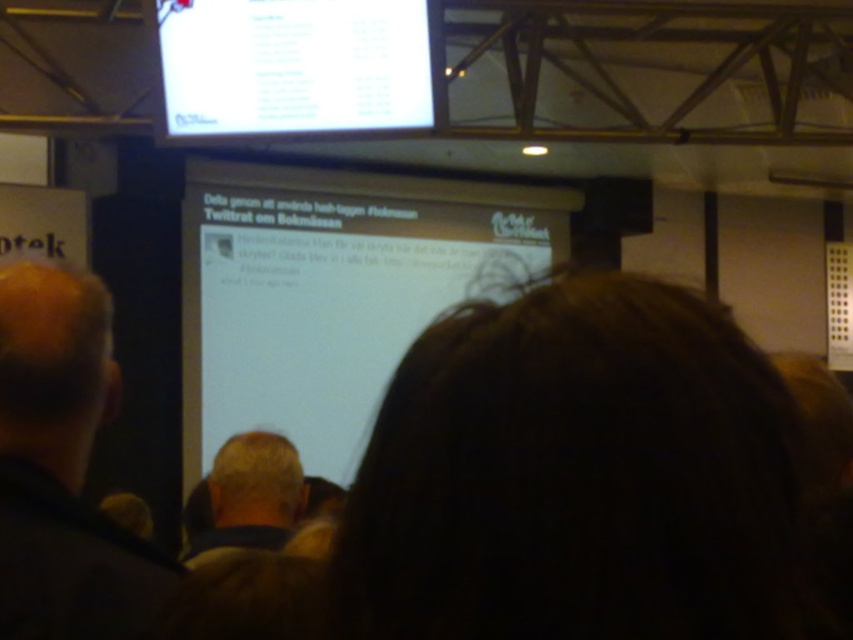
Does white glossy screen at upper center have a smaller size compared to blonde hair at center?

Actually, white glossy screen at upper center might be larger than blonde hair at center.

Is white glossy screen at upper center shorter than blonde hair at center?

In fact, white glossy screen at upper center may be taller than blonde hair at center.

Who is more distant from viewer, (360,1) or (276,481)?

The point (360,1) is more distant.

Locate an element on the screen. This screenshot has width=853, height=640. white glossy screen at upper center is located at coordinates (299, 67).

Who is shorter, white matte screen at center or blonde hair at center?

blonde hair at center

Is point (416, 332) more distant than point (270, 444)?

Yes, it is.

Who is more forward, (221, 182) or (225, 500)?

Point (225, 500) is more forward.

Identify the location of white matte screen at center. (331, 292).

Is white matte screen at center thinner than dark brown hair at center?

No.

Does white matte screen at center lie in front of dark brown hair at center?

No, it is behind dark brown hair at center.

Is point (380, 321) positioned in front of point (12, 371)?

No, it is behind (12, 371).

Locate an element on the screen. This screenshot has width=853, height=640. white matte screen at center is located at coordinates (331, 292).